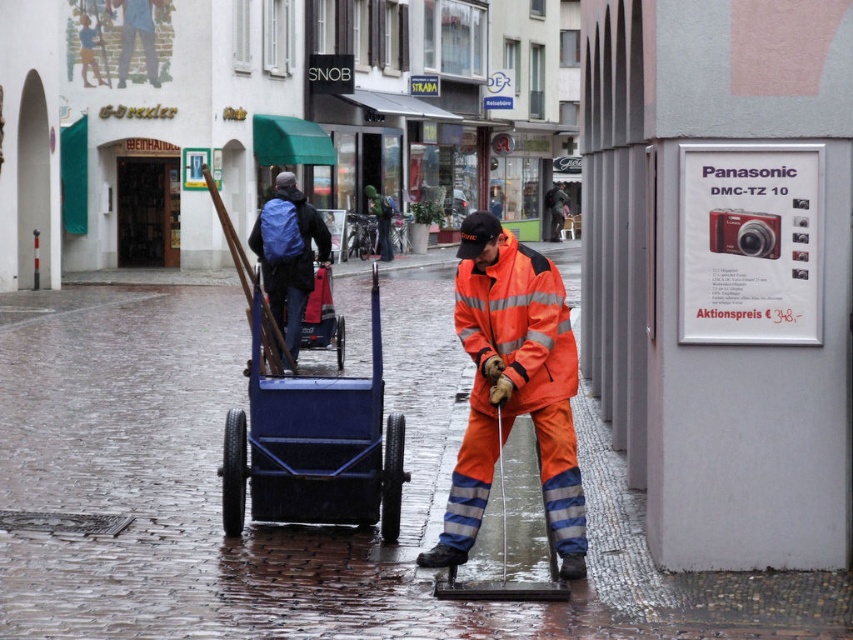
Looking at this image, you are a pedestrian standing at the point with coordinates point (393,470). You want to walk to the point with coordinates point (479,280). Which direction should you move relative to your current position?

You should move forward because point (479,280) is in front of point (393,470).

You are a pedestrian trying to cross the wet cobblestone street. There is an orange reflective fabric at center. Where should you step to avoid the maintenance workers and their equipment?

The orange reflective fabric at center is located at point (515, 387), so you should step around it to avoid the maintenance workers and their equipment.